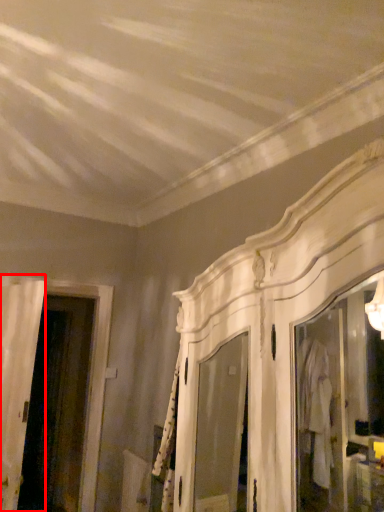
Question: From the image's perspective, what is the correct spatial relationship of door (annotated by the red box) in relation to screen door?

Choices:
 (A) above
 (B) below

Answer: (A)